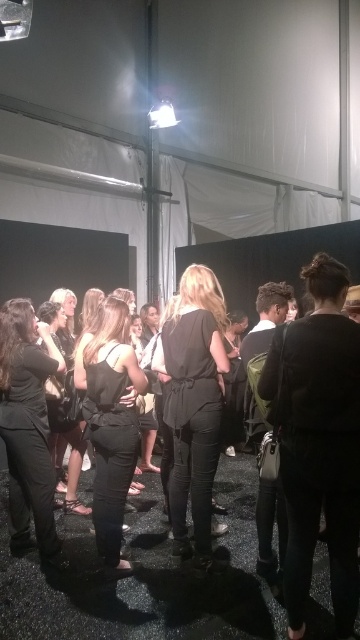
Question: Does matte black top at center lie in front of black matte dress at center?

Choices:
 (A) no
 (B) yes

Answer: (A)

Question: Which point appears farthest from the camera in this image?

Choices:
 (A) (138, 369)
 (B) (33, 353)

Answer: (B)

Question: Does matte black blouse at center lie behind matte black top at center?

Choices:
 (A) yes
 (B) no

Answer: (B)

Question: Among these points, which one is nearest to the camera?

Choices:
 (A) (36, 381)
 (B) (192, 476)

Answer: (B)

Question: Estimate the real-world distances between objects in this image. Which object is closer to the matte black blouse at center?

Choices:
 (A) matte black top at center
 (B) black matte dress at center

Answer: (B)

Question: Is matte black blouse at center thinner than black matte dress at center?

Choices:
 (A) no
 (B) yes

Answer: (B)